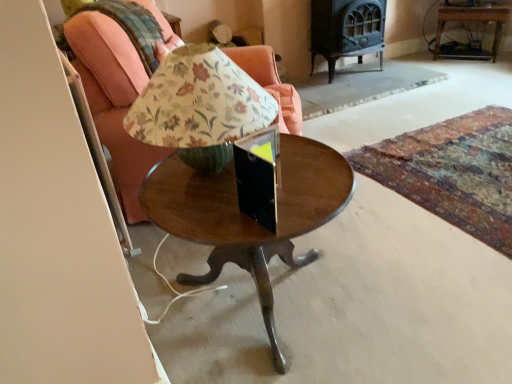
Question: Does wooden round table at center appear on the right side of wooden side table at upper right?

Choices:
 (A) no
 (B) yes

Answer: (A)

Question: Is wooden round table at center behind wooden side table at upper right?

Choices:
 (A) no
 (B) yes

Answer: (A)

Question: From a real-world perspective, does wooden round table at center sit lower than wooden side table at upper right?

Choices:
 (A) no
 (B) yes

Answer: (A)

Question: Is wooden side table at upper right located within wooden round table at center?

Choices:
 (A) no
 (B) yes

Answer: (A)

Question: Is wooden round table at center not near wooden side table at upper right?

Choices:
 (A) yes
 (B) no

Answer: (A)

Question: Would you say wooden round table at center is outside wooden side table at upper right?

Choices:
 (A) yes
 (B) no

Answer: (A)

Question: Considering the relative positions of matte wood chair at center and wooden side table at upper right in the image provided, is matte wood chair at center in front of wooden side table at upper right?

Choices:
 (A) yes
 (B) no

Answer: (A)

Question: Considering the relative sizes of matte wood chair at center and wooden side table at upper right in the image provided, is matte wood chair at center smaller than wooden side table at upper right?

Choices:
 (A) no
 (B) yes

Answer: (A)

Question: Is matte wood chair at center at the left side of wooden side table at upper right?

Choices:
 (A) no
 (B) yes

Answer: (B)

Question: Is matte wood chair at center behind wooden side table at upper right?

Choices:
 (A) yes
 (B) no

Answer: (B)

Question: Does matte wood chair at center have a larger size compared to wooden side table at upper right?

Choices:
 (A) yes
 (B) no

Answer: (A)

Question: From a real-world perspective, is matte wood chair at center on wooden side table at upper right?

Choices:
 (A) no
 (B) yes

Answer: (B)

Question: From a real-world perspective, is wooden side table at upper right physically below wooden round table at center?

Choices:
 (A) no
 (B) yes

Answer: (B)